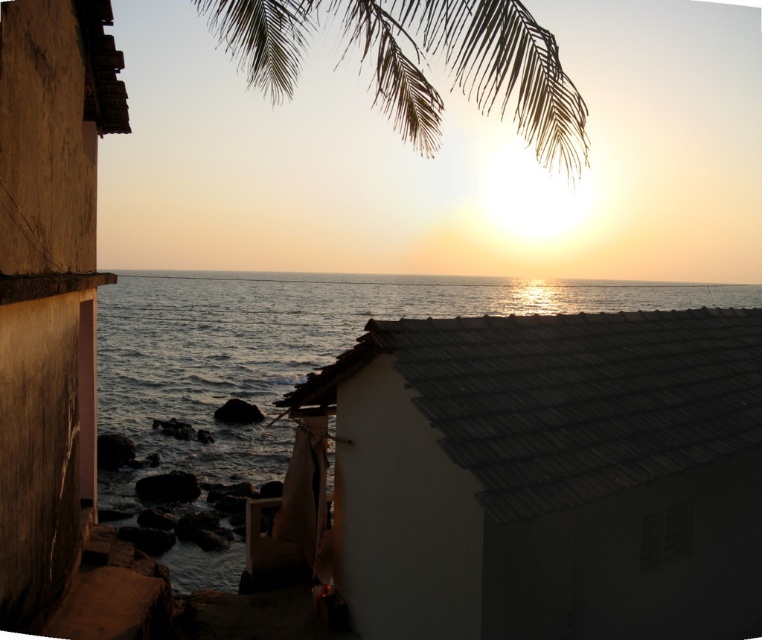
You are standing in the coastal scene and want to take a photo of the smooth brown wall at left and the silvery textured leaves at upper center. Which object will appear larger in the photo?

The silvery textured leaves at upper center will appear larger in the photo because they are taller than the smooth brown wall at left.

You are standing in front of the smooth brown wall at left and the blue water at center. Which object is closer to you?

The smooth brown wall at left is closer to you since it is positioned further to the viewer than the blue water at center, meaning it appears nearer in the scene.

You are standing at the center of the image and want to locate the blue water at center. What are the coordinates where you should look?

The blue water at center is located at coordinates point (290, 348).